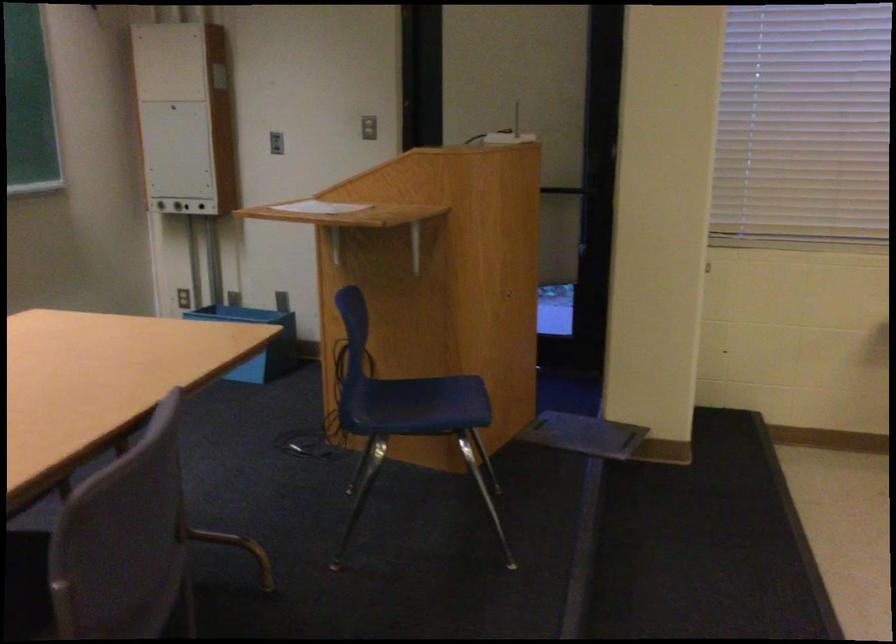
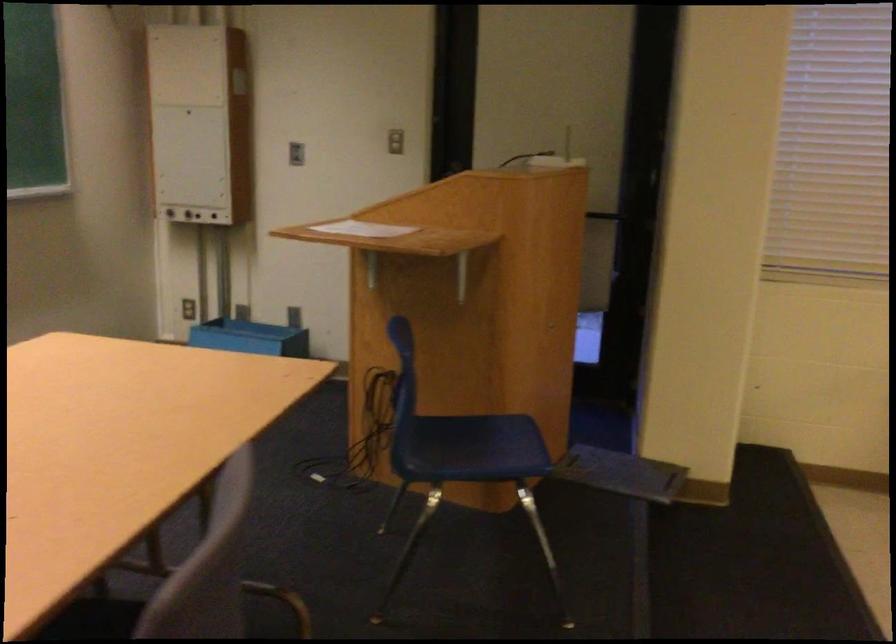
Locate, in the second image, the point that corresponds to the point at 156,203 in the first image.

(167, 210)